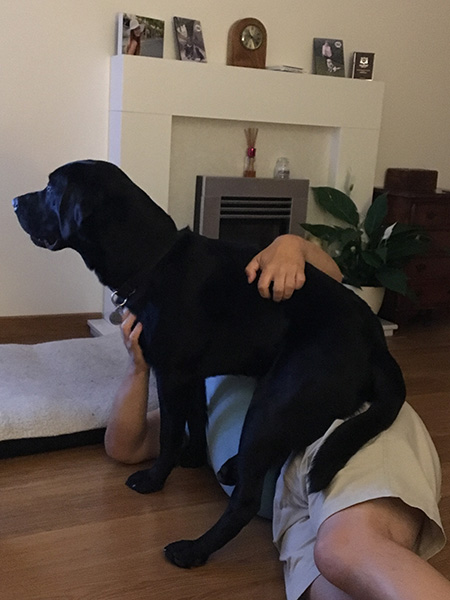
Identify the location of clock. (247, 51).